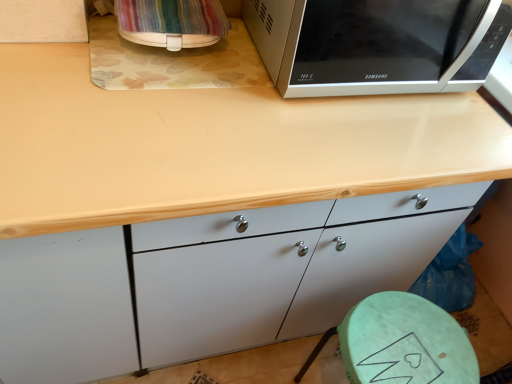
Where is `vacant space in front of striped fabric bag at upper left`? This screenshot has width=512, height=384. vacant space in front of striped fabric bag at upper left is located at coordinates click(x=142, y=91).